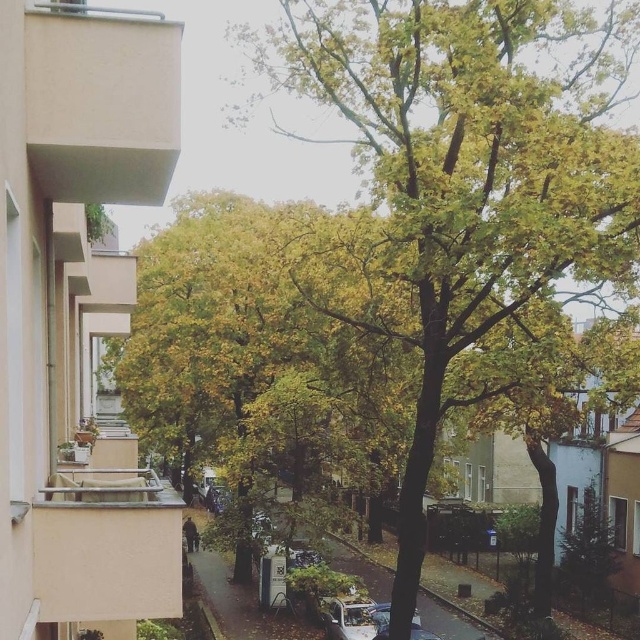
You are standing on the balcony of the beige building and looking down at the street. You see a green leafy tree at center and a metallic silver car at lower center. Which object is closer to you?

The green leafy tree at center is closer to you because it is in front of the metallic silver car at lower center.

You are standing on the balcony of the beige building on the left. You see a point marked at coordinates (470,170). What object is located at that point?

The point at coordinates (470,170) indicates a green leafy tree at center.